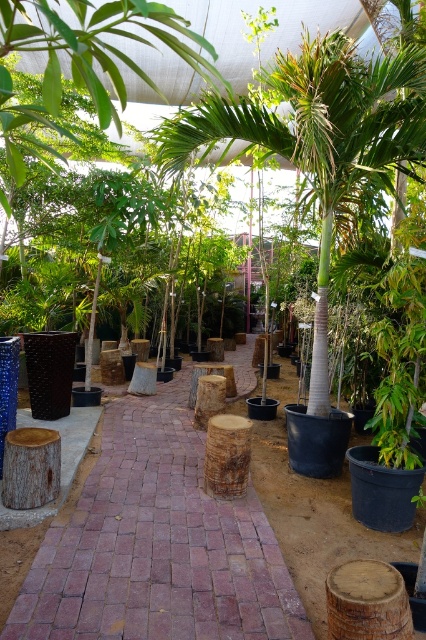
Question: Is brick paved path at center closer to the viewer compared to green leafy palm tree at center?

Choices:
 (A) no
 (B) yes

Answer: (B)

Question: Does brick paved path at center appear on the right side of green leafy palm tree at center?

Choices:
 (A) yes
 (B) no

Answer: (B)

Question: Can you confirm if brick paved path at center is positioned above green leafy palm tree at center?

Choices:
 (A) yes
 (B) no

Answer: (B)

Question: Which point is farther to the camera?

Choices:
 (A) (288, 77)
 (B) (126, 595)

Answer: (A)